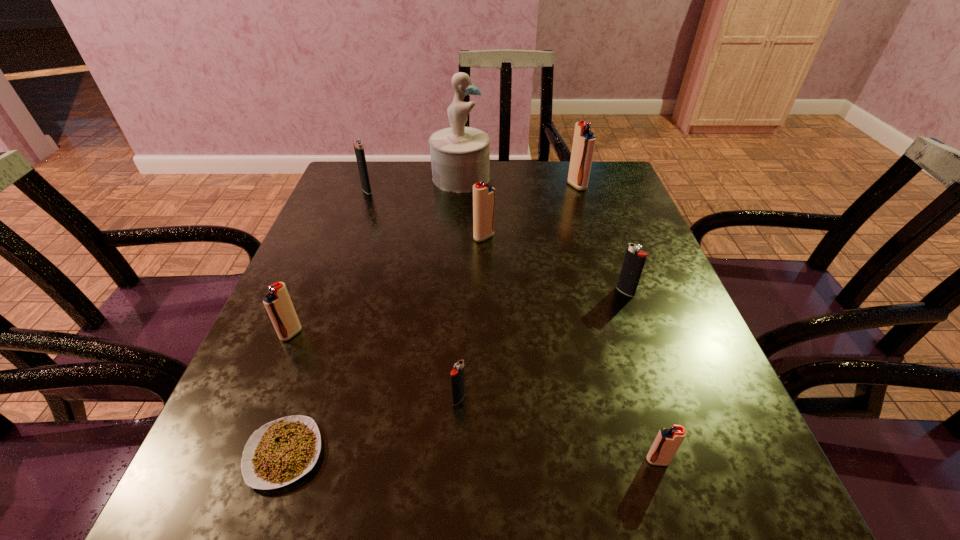
Locate an element on the screen. free space between the tallest object and the second biggest red igniter is located at coordinates (472, 207).

Identify the location of free area in between the fifth farthest igniter and the second black igniter from left to right. Image resolution: width=960 pixels, height=540 pixels. (375, 366).

The height and width of the screenshot is (540, 960). I want to click on free spot between the sixth igniter from right to left and the nearest red igniter, so click(513, 325).

The image size is (960, 540). In order to click on object that can be found as the closest to the legume in this screenshot , I will do `click(278, 304)`.

Locate an element on the screen. Image resolution: width=960 pixels, height=540 pixels. object that stands as the third closest to the sixth farthest igniter is located at coordinates (278, 304).

Locate which igniter ranks sixth in proximity to the shortest object. Please provide its 2D coordinates. Your answer should be formatted as a tuple, i.e. [(x, y)], where the tuple contains the x and y coordinates of a point satisfying the conditions above.

[(358, 144)]

At what (x,y) coordinates should I click in order to perform the action: click on the fifth closest igniter to the nearest igniter. Please return your answer as a coordinate pair (x, y). Looking at the image, I should click on (584, 140).

Point out which red igniter is positioned as the second nearest to the fourth farthest igniter. Please provide its 2D coordinates. Your answer should be formatted as a tuple, i.e. [(x, y)], where the tuple contains the x and y coordinates of a point satisfying the conditions above.

[(668, 440)]

Point out which red igniter is positioned as the second nearest to the leftmost black igniter. Please provide its 2D coordinates. Your answer should be formatted as a tuple, i.e. [(x, y)], where the tuple contains the x and y coordinates of a point satisfying the conditions above.

[(278, 304)]

I want to click on the second closest black igniter to the tallest object, so click(x=634, y=260).